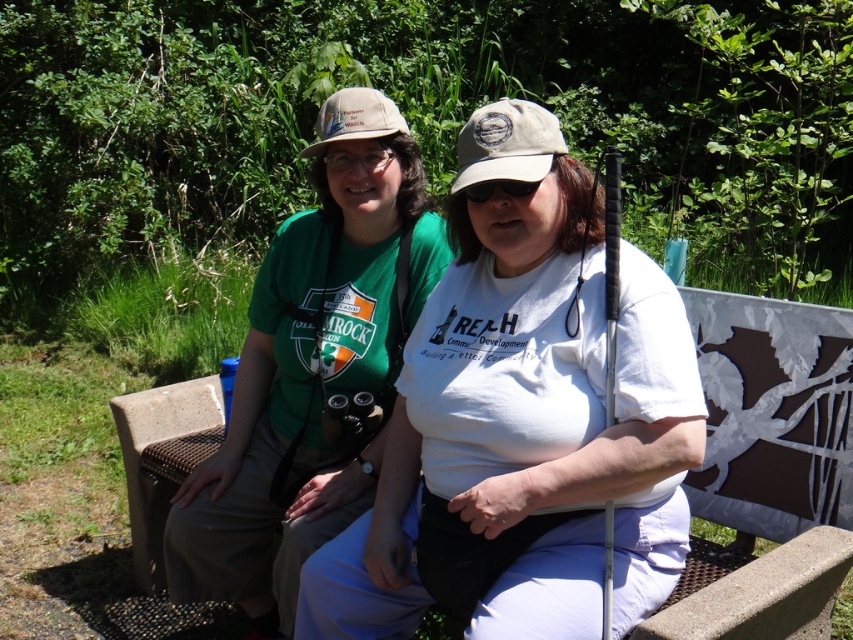
Question: Estimate the real-world distances between objects in this image. Which object is farther from the beige fabric baseball cap at center?

Choices:
 (A) khaki fabric baseball cap at center
 (B) green fabric shirt at center
 (C) concrete bench at center

Answer: (C)

Question: From the image, what is the correct spatial relationship of white matte shirt at center in relation to beige fabric baseball cap at center?

Choices:
 (A) below
 (B) above

Answer: (A)

Question: Which of the following is the farthest from the observer?

Choices:
 (A) (758, 387)
 (B) (610, 476)
 (C) (519, 100)

Answer: (A)

Question: Can you confirm if white matte shirt at center is positioned above concrete bench at center?

Choices:
 (A) no
 (B) yes

Answer: (B)

Question: Is white matte shirt at center further to camera compared to beige fabric baseball cap at center?

Choices:
 (A) yes
 (B) no

Answer: (B)

Question: Which of the following is the farthest from the observer?

Choices:
 (A) (512, 173)
 (B) (566, 632)
 (C) (328, 109)
 (D) (216, 428)

Answer: (D)